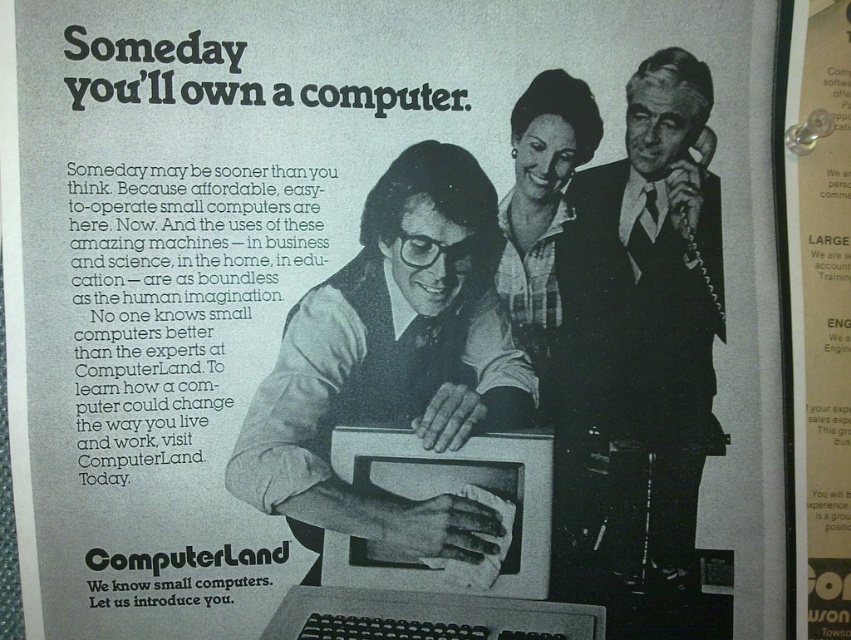
Question: Is matte black computer at center closer to the viewer compared to satin black suit at upper right?

Choices:
 (A) yes
 (B) no

Answer: (A)

Question: Among these points, which one is farthest from the camera?

Choices:
 (A) (690, 294)
 (B) (443, 538)

Answer: (A)

Question: Which point is farther to the camera?

Choices:
 (A) (650, 285)
 (B) (389, 422)

Answer: (A)

Question: Which of the following is the closest to the observer?

Choices:
 (A) (644, 490)
 (B) (301, 529)

Answer: (B)

Question: Does matte black computer at center come behind satin black suit at upper right?

Choices:
 (A) yes
 (B) no

Answer: (B)

Question: Is matte black computer at center positioned behind satin black suit at upper right?

Choices:
 (A) yes
 (B) no

Answer: (B)